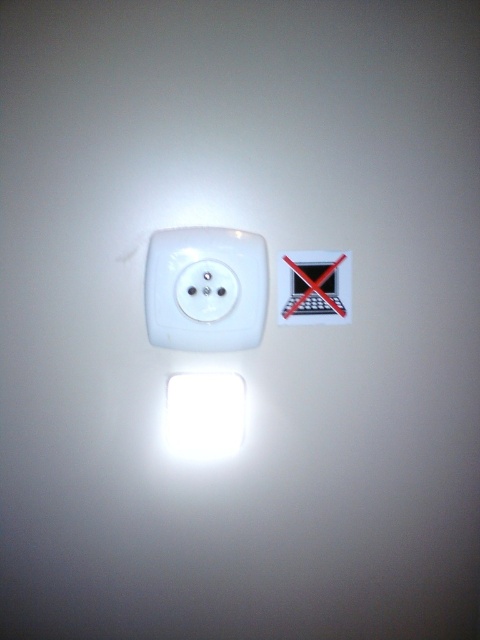
Is white glossy electric outlet at center to the left of white plastic light switch at center from the viewer's perspective?

Yes, white glossy electric outlet at center is to the left of white plastic light switch at center.

Is white glossy electric outlet at center further to the viewer compared to white plastic light switch at center?

No, white glossy electric outlet at center is closer to the viewer.

Is point (199, 300) positioned before point (278, 276)?

Yes, it is in front of point (278, 276).

Image resolution: width=480 pixels, height=640 pixels. Identify the location of white glossy electric outlet at center. (205, 289).

Is point (241, 435) positioned before point (316, 284)?

Yes, it is.

The width and height of the screenshot is (480, 640). I want to click on white glossy light at center, so pyautogui.click(x=205, y=412).

Locate an element on the screen. This screenshot has width=480, height=640. white glossy light at center is located at coordinates (205, 412).

Can you confirm if white glossy electric outlet at center is shorter than white glossy light at center?

Incorrect, white glossy electric outlet at center's height does not fall short of white glossy light at center's.

Is the position of white glossy electric outlet at center more distant than that of white glossy light at center?

No, white glossy electric outlet at center is in front of white glossy light at center.

Which is in front, point (254, 292) or point (183, 424)?

Positioned in front is point (254, 292).

Locate an element on the screen. This screenshot has height=640, width=480. white glossy electric outlet at center is located at coordinates (205, 289).